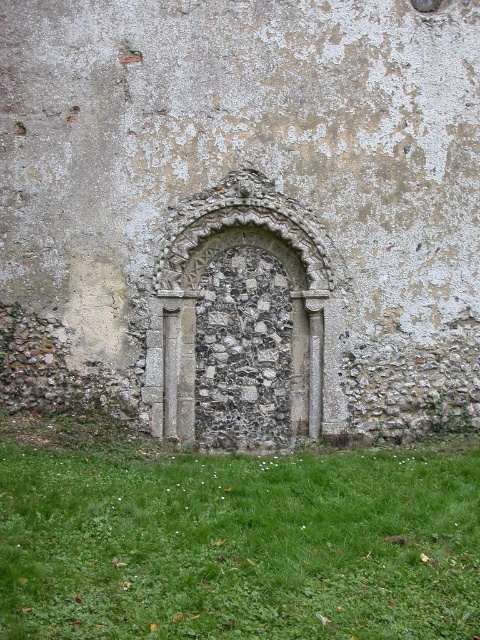
You are a gardener looking to trim the green grass at lower center so it doesn not block the view of the stone textured archway at center. Can you confirm if the grass is currently shorter than the archway?

The green grass at lower center has a lesser height compared to stone textured archway at center, so yes, the grass is currently shorter than the archway and does not block the view.